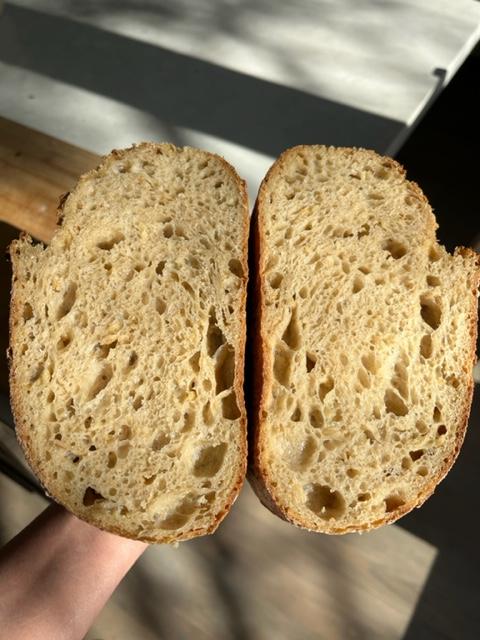
You are a GUI agent. You are given a task and a screenshot of the screen. Output one action in this format:
    pyautogui.click(x=<x>, y=<y>)
    Task: Click on the wood grain
    
    Given the screenshot: What is the action you would take?
    pyautogui.click(x=46, y=164)